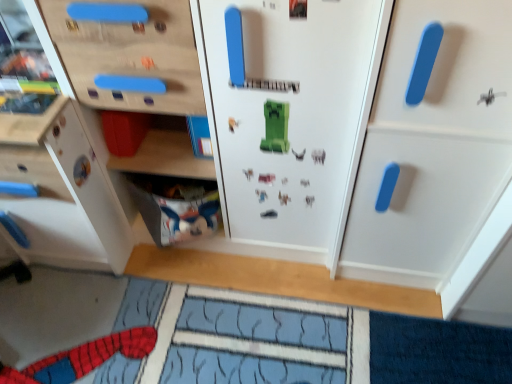
Question: Is white matte cabinet at right, which is the first cabinetry from right to left, looking in the opposite direction of white matte cabinet at left, the second cabinetry viewed from the right?

Choices:
 (A) no
 (B) yes

Answer: (A)

Question: Is white matte cabinet at right, arranged as the second cabinetry when viewed from the left, closer to the viewer compared to white matte cabinet at left, the second cabinetry viewed from the right?

Choices:
 (A) yes
 (B) no

Answer: (A)

Question: From the image's perspective, is white matte cabinet at right, arranged as the second cabinetry when viewed from the left, above white matte cabinet at left, positioned as the first cabinetry in left-to-right order?

Choices:
 (A) no
 (B) yes

Answer: (A)

Question: From a real-world perspective, is white matte cabinet at right, which is the first cabinetry from right to left, on top of white matte cabinet at left, positioned as the first cabinetry in left-to-right order?

Choices:
 (A) yes
 (B) no

Answer: (A)

Question: Is white matte cabinet at right, which is the first cabinetry from right to left, to the left of white matte cabinet at left, positioned as the first cabinetry in left-to-right order, from the viewer's perspective?

Choices:
 (A) yes
 (B) no

Answer: (B)

Question: Is white matte cabinet at right, arranged as the second cabinetry when viewed from the left, wider than white matte cabinet at left, positioned as the first cabinetry in left-to-right order?

Choices:
 (A) yes
 (B) no

Answer: (B)

Question: Considering the relative sizes of white fabric at lower left and white matte cabinet at left, the second cabinetry viewed from the right, in the image provided, is white fabric at lower left thinner than white matte cabinet at left, the second cabinetry viewed from the right,?

Choices:
 (A) yes
 (B) no

Answer: (A)

Question: Is white fabric at lower left behind white matte cabinet at left, positioned as the first cabinetry in left-to-right order?

Choices:
 (A) yes
 (B) no

Answer: (A)

Question: Is white fabric at lower left completely or partially outside of white matte cabinet at left, the second cabinetry viewed from the right?

Choices:
 (A) yes
 (B) no

Answer: (A)

Question: Are white fabric at lower left and white matte cabinet at left, positioned as the first cabinetry in left-to-right order, located far from each other?

Choices:
 (A) no
 (B) yes

Answer: (A)

Question: Is white fabric at lower left to the right of white matte cabinet at left, positioned as the first cabinetry in left-to-right order, from the viewer's perspective?

Choices:
 (A) no
 (B) yes

Answer: (B)

Question: Can you confirm if white fabric at lower left is positioned to the left of white matte cabinet at left, positioned as the first cabinetry in left-to-right order?

Choices:
 (A) yes
 (B) no

Answer: (B)

Question: Is white matte cabinet at left, the second cabinetry viewed from the right, at the left side of white matte cabinet at right, which is the first cabinetry from right to left?

Choices:
 (A) yes
 (B) no

Answer: (A)